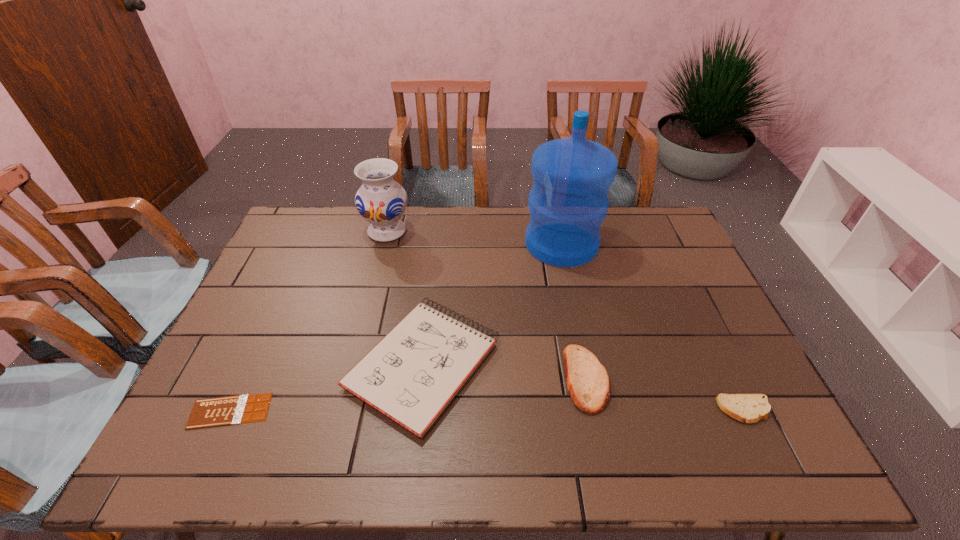
Locate an element on the screen. This screenshot has width=960, height=540. water jug is located at coordinates (568, 202).

The width and height of the screenshot is (960, 540). In order to click on the fifth shortest object in this screenshot , I will do `click(380, 200)`.

Locate an element on the screen. This screenshot has width=960, height=540. notepad is located at coordinates (411, 375).

Identify the location of the left pita bread. Image resolution: width=960 pixels, height=540 pixels. (587, 381).

What are the coordinates of `the rightmost object` in the screenshot? It's located at (750, 408).

Find the location of a particular element. the shorter pita bread is located at coordinates (750, 408).

This screenshot has width=960, height=540. What are the coordinates of `the shortest object` in the screenshot? It's located at (211, 412).

Find the location of a particular element. Image resolution: width=960 pixels, height=540 pixels. the leftmost object is located at coordinates (211, 412).

Locate an element on the screen. Image resolution: width=960 pixels, height=540 pixels. vacant space positioned 0.130m on the front of the tallest object is located at coordinates (573, 298).

You are a GUI agent. You are given a task and a screenshot of the screen. Output one action in this format:
    pyautogui.click(x=<x>, y=<y>)
    Task: Click on the free region located 0.340m on the front of the second tallest object
    The image size is (960, 540).
    Given the screenshot: What is the action you would take?
    pyautogui.click(x=364, y=322)